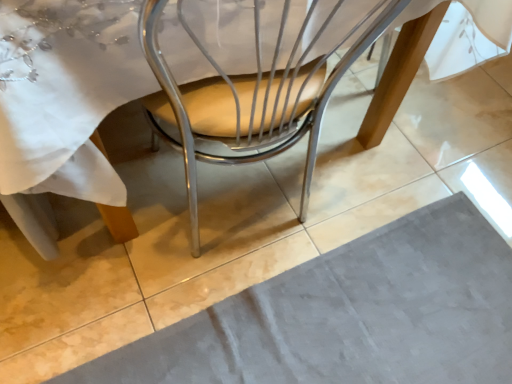
Question: From the image's perspective, is gray velvety place mat at lower center located above or below metallic tan chair at center?

Choices:
 (A) below
 (B) above

Answer: (A)

Question: Is gray velvety place mat at lower center spatially inside metallic tan chair at center, or outside of it?

Choices:
 (A) outside
 (B) inside

Answer: (A)

Question: From a real-world perspective, is gray velvety place mat at lower center positioned above or below metallic tan chair at center?

Choices:
 (A) below
 (B) above

Answer: (A)

Question: Is metallic tan chair at center wider or thinner than gray velvety place mat at lower center?

Choices:
 (A) wide
 (B) thin

Answer: (B)

Question: Would you say metallic tan chair at center is inside or outside gray velvety place mat at lower center?

Choices:
 (A) inside
 (B) outside

Answer: (B)

Question: In the image, is metallic tan chair at center positioned in front of or behind gray velvety place mat at lower center?

Choices:
 (A) behind
 (B) front

Answer: (B)

Question: In terms of size, does metallic tan chair at center appear bigger or smaller than gray velvety place mat at lower center?

Choices:
 (A) big
 (B) small

Answer: (A)